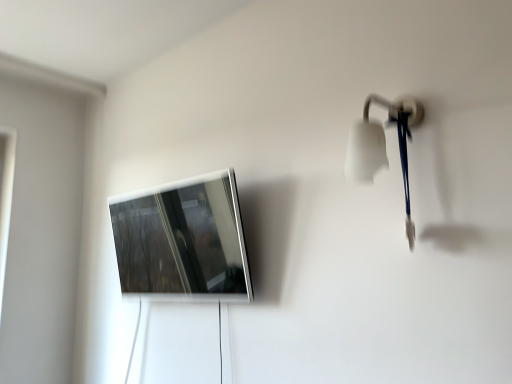
I want to click on silver glossy picture frame at center-left, so click(183, 241).

Describe the element at coordinates (183, 241) in the screenshot. The image size is (512, 384). I see `silver glossy picture frame at center-left` at that location.

Identify the location of silver glossy picture frame at center-left. This screenshot has width=512, height=384. (183, 241).